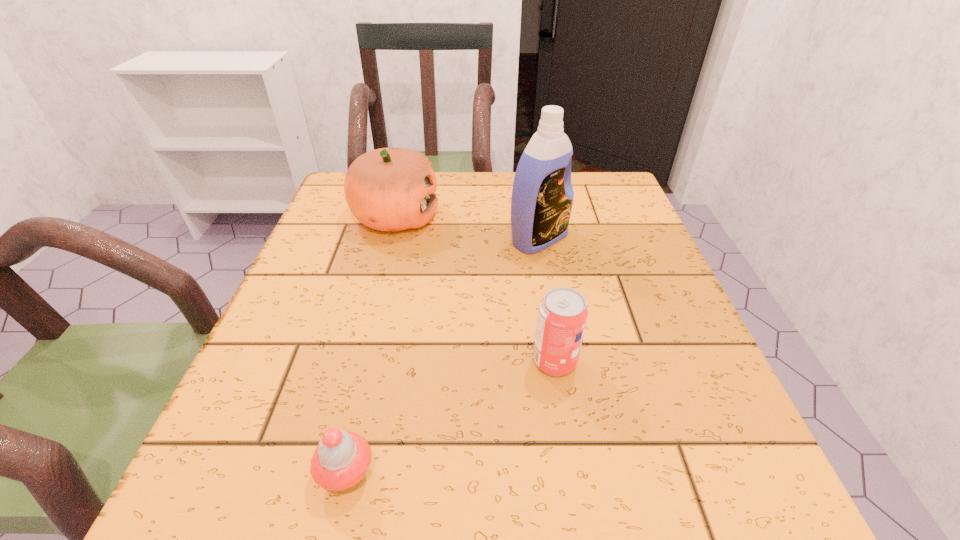
Locate an element on the screen. the tallest object is located at coordinates (542, 197).

At what (x,y) coordinates should I click in order to perform the action: click on the third shortest object. Please return your answer as a coordinate pair (x, y). The width and height of the screenshot is (960, 540). Looking at the image, I should click on (389, 189).

Image resolution: width=960 pixels, height=540 pixels. Find the location of `soda can`. soda can is located at coordinates (562, 316).

Where is `the second shortest object`? The height and width of the screenshot is (540, 960). the second shortest object is located at coordinates (562, 316).

In order to click on the nearest object in this screenshot , I will do pos(340,462).

Where is `cupcake`? The image size is (960, 540). cupcake is located at coordinates (340, 462).

Identify the location of blank space located 0.170m on the right of the tallest object. (648, 239).

Locate an element on the screen. vacant area located on the face of the second tallest object is located at coordinates (580, 217).

In order to click on free space located on the front of the soda can in this screenshot , I will do `click(565, 427)`.

Find the location of `free space located 0.160m on the right of the cupcake`. free space located 0.160m on the right of the cupcake is located at coordinates (498, 474).